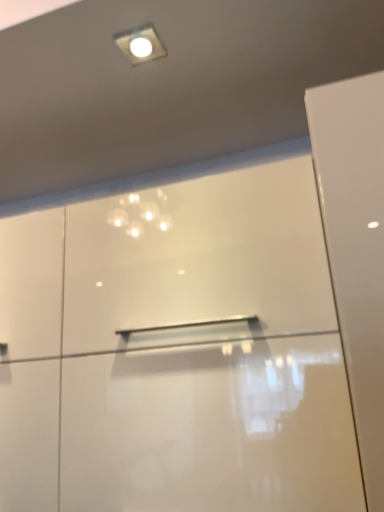
Image resolution: width=384 pixels, height=512 pixels. What are the coordinates of `vacant space to the left of white glossy droplight at upper center` in the screenshot? It's located at (71, 53).